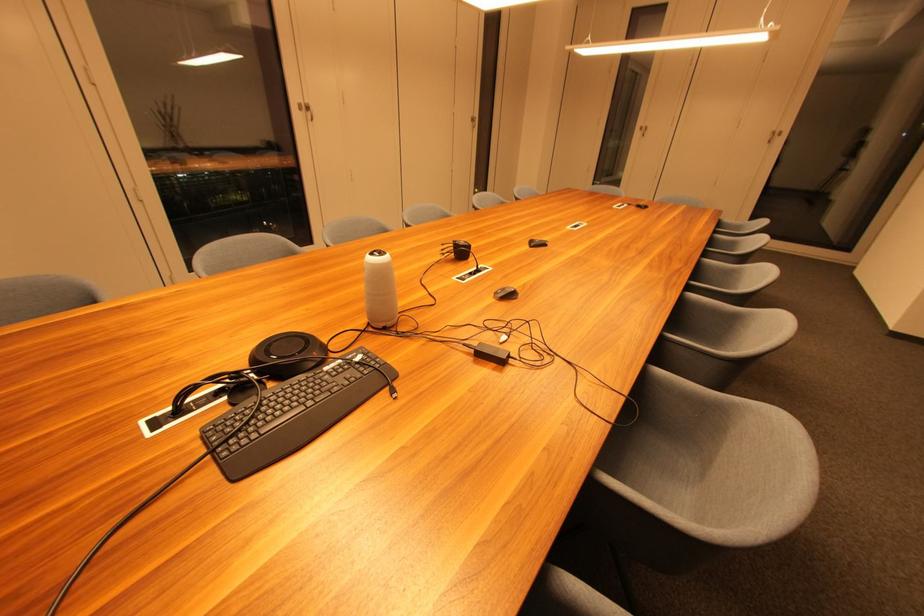
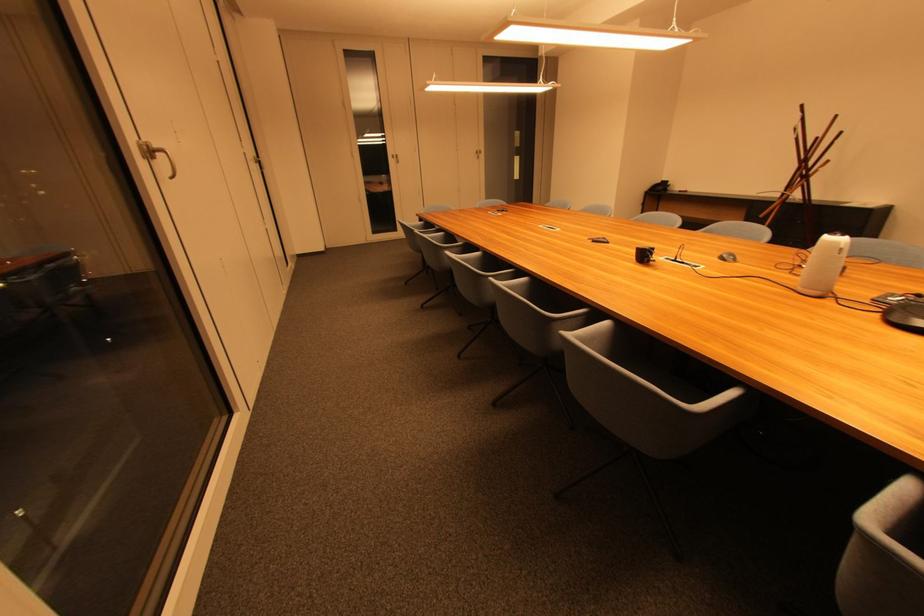
Find the pixel in the second image that matches the point at 306,111 in the first image.

(148, 159)